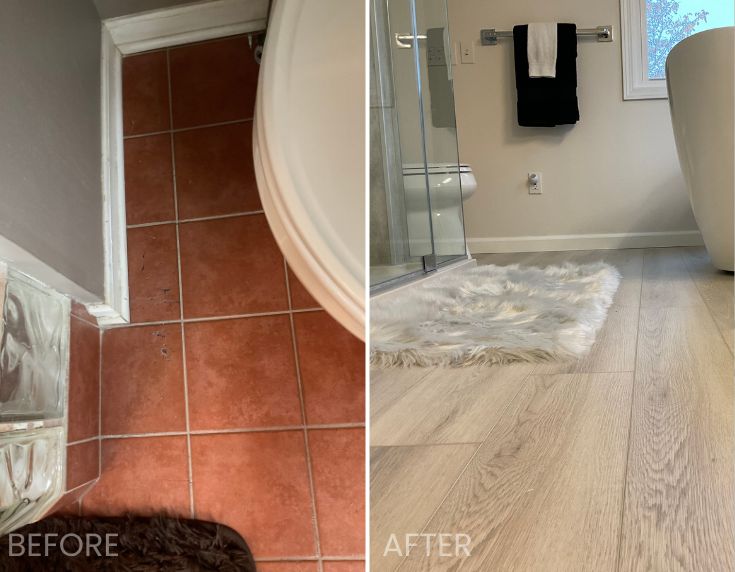
What are the coordinates of `window` in the screenshot? It's located at (667, 23).